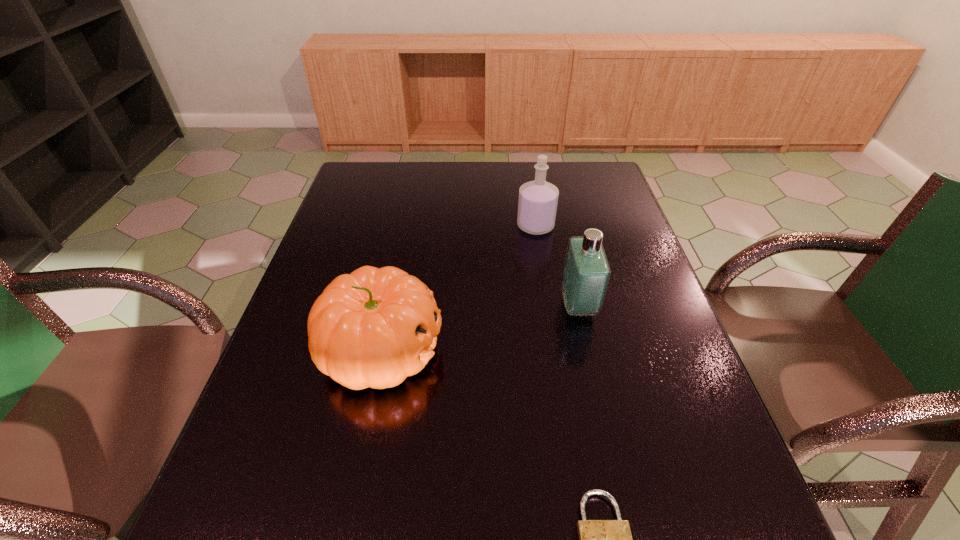
Locate an element on the screen. This screenshot has width=960, height=540. the farther perfume is located at coordinates (537, 205).

Where is `the nearer perfume`? The width and height of the screenshot is (960, 540). the nearer perfume is located at coordinates (586, 275).

At what (x,y) coordinates should I click in order to perform the action: click on pumpkin. Please return your answer as a coordinate pair (x, y). Image resolution: width=960 pixels, height=540 pixels. Looking at the image, I should click on (374, 327).

Find the location of `vacant point located 0.280m on the front of the farther perfume`. vacant point located 0.280m on the front of the farther perfume is located at coordinates (x=548, y=308).

At what (x,y) coordinates should I click in order to perform the action: click on vacant space situated on the front label of the nearer perfume. Please return your answer as a coordinate pair (x, y). Image resolution: width=960 pixels, height=540 pixels. Looking at the image, I should click on (407, 306).

Where is `vacant space located on the front label of the nearer perfume`? vacant space located on the front label of the nearer perfume is located at coordinates (477, 306).

You are a GUI agent. You are given a task and a screenshot of the screen. Output one action in this format:
    pyautogui.click(x=<x>, y=<y>)
    Task: Click on the free space located on the front label of the nearer perfume
    This screenshot has height=540, width=960.
    Given the screenshot: What is the action you would take?
    pyautogui.click(x=456, y=306)

The width and height of the screenshot is (960, 540). I want to click on vacant region located on the carved face of the leftmost object, so click(489, 349).

The height and width of the screenshot is (540, 960). What are the coordinates of `object that is at the left edge` in the screenshot? It's located at (374, 327).

The image size is (960, 540). What are the coordinates of `free point at the far edge` in the screenshot? It's located at (475, 189).